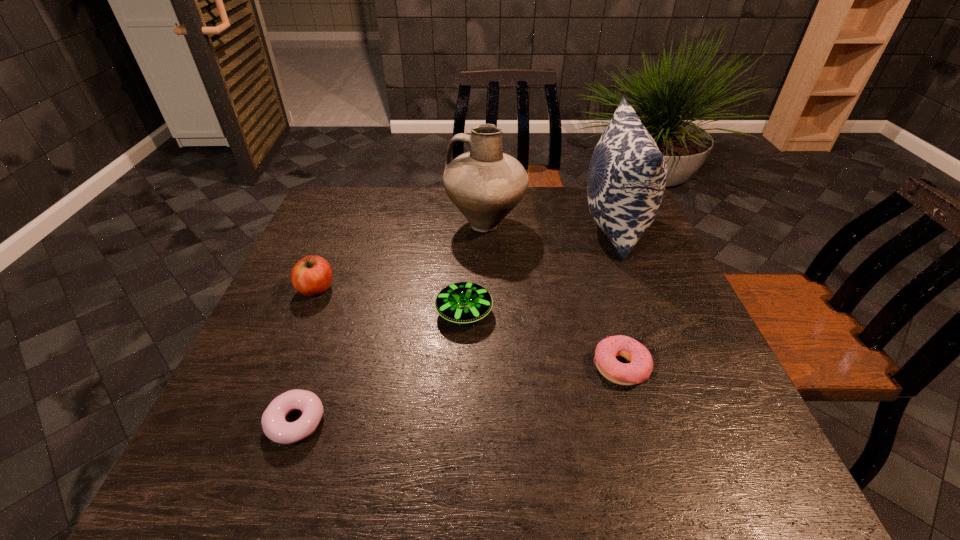
Where is `cushion`? The width and height of the screenshot is (960, 540). cushion is located at coordinates pyautogui.click(x=627, y=174).

I want to click on pitcher, so click(485, 184).

At what (x,y) coordinates should I click in order to perform the action: click on the third tallest object. Please return your answer as a coordinate pair (x, y). The height and width of the screenshot is (540, 960). Looking at the image, I should click on (312, 275).

This screenshot has height=540, width=960. In order to click on saucer in this screenshot , I will do `click(464, 302)`.

At what (x,y) coordinates should I click in order to perform the action: click on the farther doughnut. Please return your answer as a coordinate pair (x, y). Image resolution: width=960 pixels, height=540 pixels. Looking at the image, I should click on (639, 369).

Find the location of `the right doughnut`. the right doughnut is located at coordinates (639, 369).

Where is `the nearest object`? The image size is (960, 540). the nearest object is located at coordinates (275, 427).

This screenshot has width=960, height=540. Find the location of `the left doughnut`. the left doughnut is located at coordinates (275, 427).

Find the location of a particular element. This screenshot has width=960, height=540. vacant position located 0.230m on the front surface of the cushion is located at coordinates (506, 225).

Locate an element on the screen. free space located 0.260m on the front surface of the cushion is located at coordinates (495, 225).